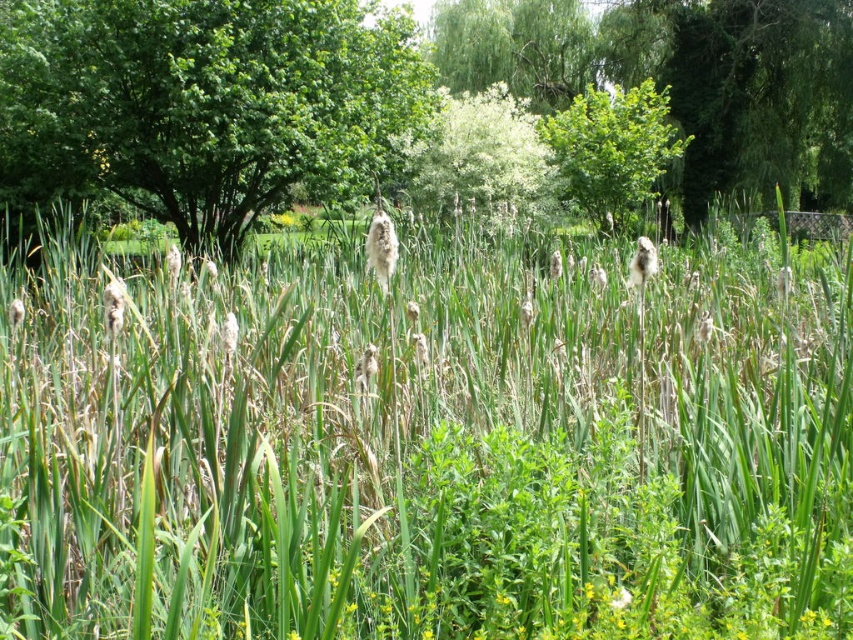
Question: Which point is closer to the camera taking this photo?

Choices:
 (A) (766, 161)
 (B) (167, 3)

Answer: (B)

Question: Which point is farther from the camera taking this photo?

Choices:
 (A) (788, 579)
 (B) (592, 204)

Answer: (B)

Question: Based on their relative distances, which object is nearer to the green leafy tree at upper right?

Choices:
 (A) green leafy tree at upper left
 (B) green grass at center
 (C) green leafy tree at upper center

Answer: (C)

Question: Is green grass at center positioned before green leafy tree at upper right?

Choices:
 (A) no
 (B) yes

Answer: (B)

Question: Is green leafy tree at upper left to the right of green leafy tree at upper right from the viewer's perspective?

Choices:
 (A) yes
 (B) no

Answer: (B)

Question: Can you confirm if green leafy tree at upper right is smaller than green leafy tree at upper center?

Choices:
 (A) no
 (B) yes

Answer: (B)